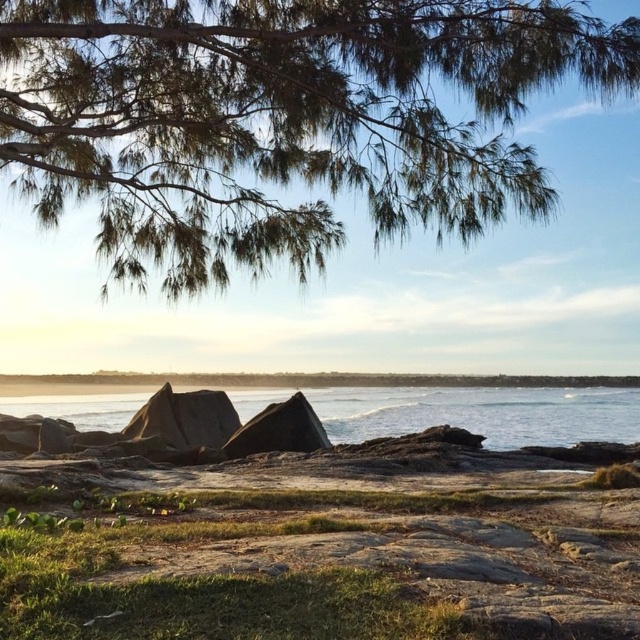
Who is higher up, green needle-like leaves at upper center or clear blue water at center?

Positioned higher is green needle-like leaves at upper center.

Where is `green needle-like leaves at upper center`? This screenshot has width=640, height=640. green needle-like leaves at upper center is located at coordinates (282, 120).

The width and height of the screenshot is (640, 640). Find the location of `green needle-like leaves at upper center`. green needle-like leaves at upper center is located at coordinates (282, 120).